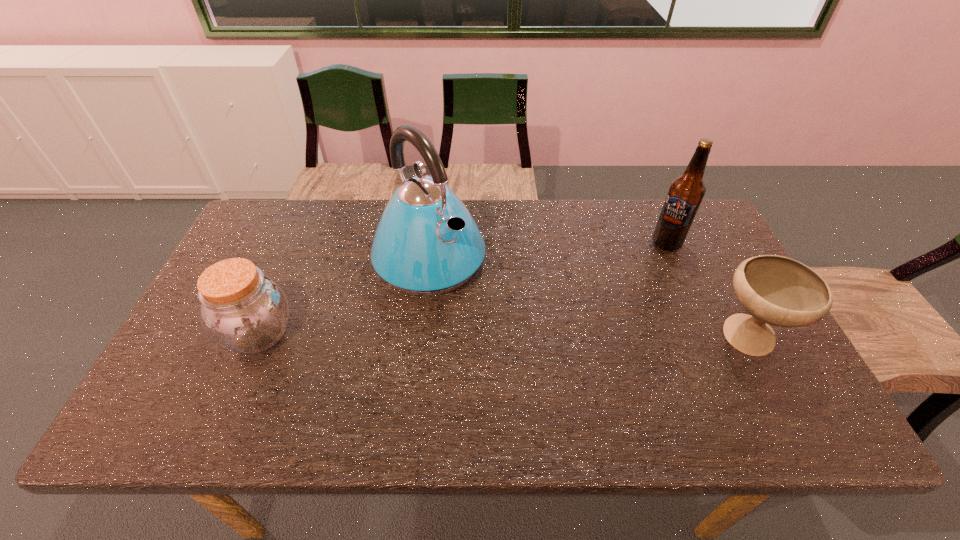
Locate an element on the screen. This screenshot has height=540, width=960. vacant space located 0.050m on the label of the beer bottle is located at coordinates (647, 256).

Locate an element on the screen. This screenshot has height=540, width=960. free region located 0.250m on the label of the beer bottle is located at coordinates (603, 287).

The image size is (960, 540). Find the location of `vacant area situated 0.390m on the label of the beer bottle`. vacant area situated 0.390m on the label of the beer bottle is located at coordinates (567, 310).

This screenshot has height=540, width=960. In order to click on kettle situated at the far edge in this screenshot , I will do `click(426, 243)`.

Find the location of a particular element. Image resolution: width=960 pixels, height=540 pixels. beer bottle situated at the far edge is located at coordinates (686, 192).

This screenshot has height=540, width=960. In order to click on jar present at the near edge in this screenshot , I will do pyautogui.click(x=243, y=310).

You are a GUI agent. You are given a task and a screenshot of the screen. Output one action in this format:
    pyautogui.click(x=<x>, y=<y>)
    Task: Click on the chalice at the near edge
    Image resolution: width=960 pixels, height=540 pixels.
    Given the screenshot: What is the action you would take?
    pyautogui.click(x=776, y=290)

Identify the location of object that is at the left edge. (243, 310).

Locate an element on the screen. chalice present at the right edge is located at coordinates (776, 290).

This screenshot has height=540, width=960. I want to click on beer bottle present at the right edge, so click(x=686, y=192).